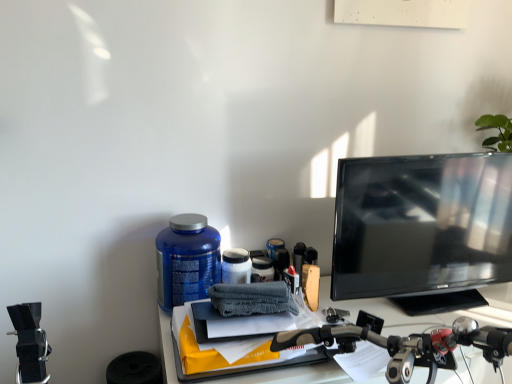
Question: Should I look upward or downward to see matte blue container at center?

Choices:
 (A) down
 (B) up

Answer: (A)

Question: Does matte blue container at center turn towards black glossy monitor at right?

Choices:
 (A) yes
 (B) no

Answer: (B)

Question: From the image's perspective, is matte blue container at center below black glossy monitor at right?

Choices:
 (A) yes
 (B) no

Answer: (A)

Question: Is matte blue container at center located outside black glossy monitor at right?

Choices:
 (A) yes
 (B) no

Answer: (A)

Question: From a real-world perspective, is matte blue container at center physically above black glossy monitor at right?

Choices:
 (A) yes
 (B) no

Answer: (B)

Question: Does matte blue container at center appear on the left side of black glossy monitor at right?

Choices:
 (A) yes
 (B) no

Answer: (A)

Question: Can you see matte blue container at center touching black glossy monitor at right?

Choices:
 (A) no
 (B) yes

Answer: (A)

Question: Does black glossy monitor at right have a larger size compared to matte blue container at center?

Choices:
 (A) yes
 (B) no

Answer: (A)

Question: Is black glossy monitor at right outside matte blue container at center?

Choices:
 (A) no
 (B) yes

Answer: (B)

Question: Is the surface of black glossy monitor at right in direct contact with matte blue container at center?

Choices:
 (A) no
 (B) yes

Answer: (A)

Question: Does black glossy monitor at right have a lesser height compared to matte blue container at center?

Choices:
 (A) no
 (B) yes

Answer: (A)

Question: Can you confirm if black glossy monitor at right is positioned to the right of matte blue container at center?

Choices:
 (A) no
 (B) yes

Answer: (B)

Question: Is the position of black glossy monitor at right more distant than that of matte blue container at center?

Choices:
 (A) yes
 (B) no

Answer: (B)

Question: Would you say black glossy monitor at right is to the left or to the right of matte blue container at center in the picture?

Choices:
 (A) right
 (B) left

Answer: (A)